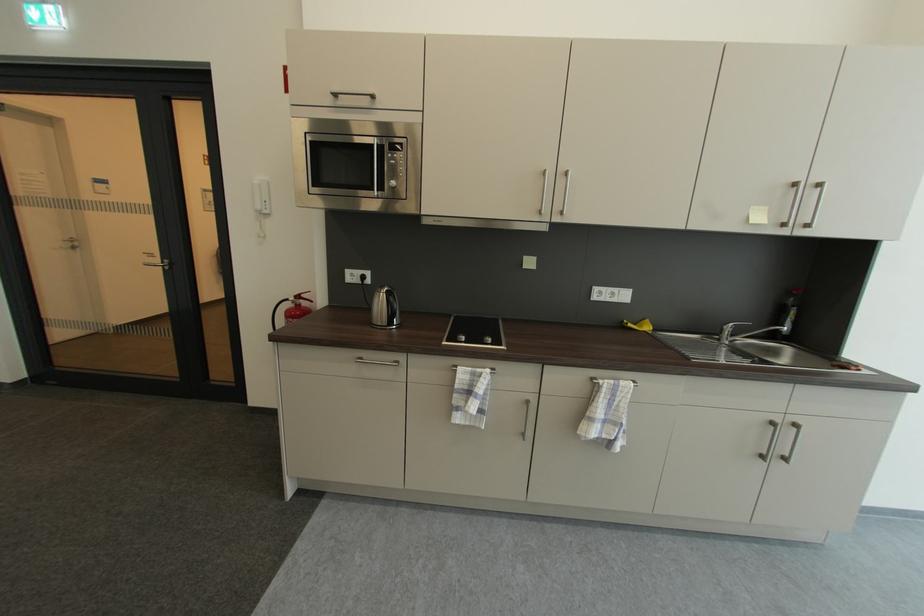
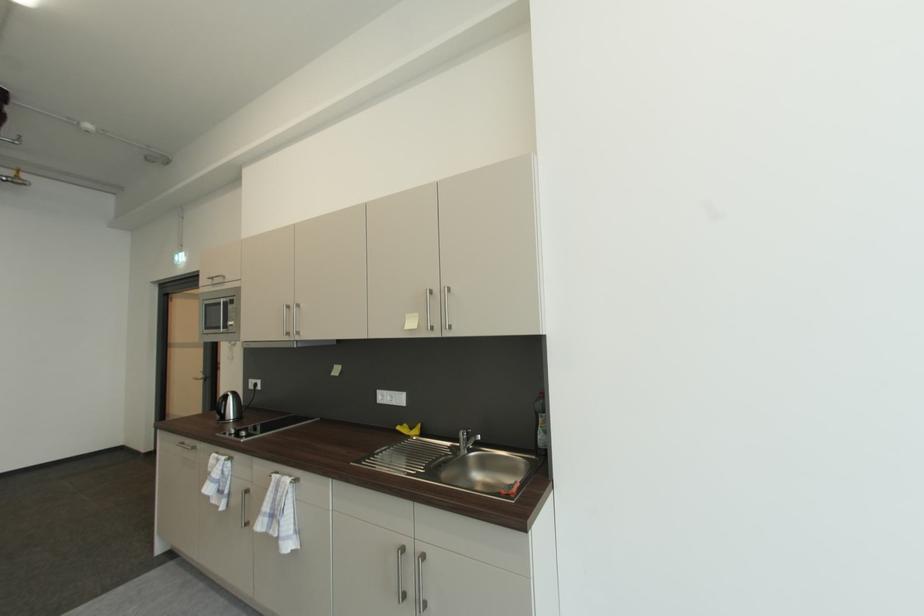
Find the pixel in the second image that matches pixel 604 385 in the first image.

(277, 477)